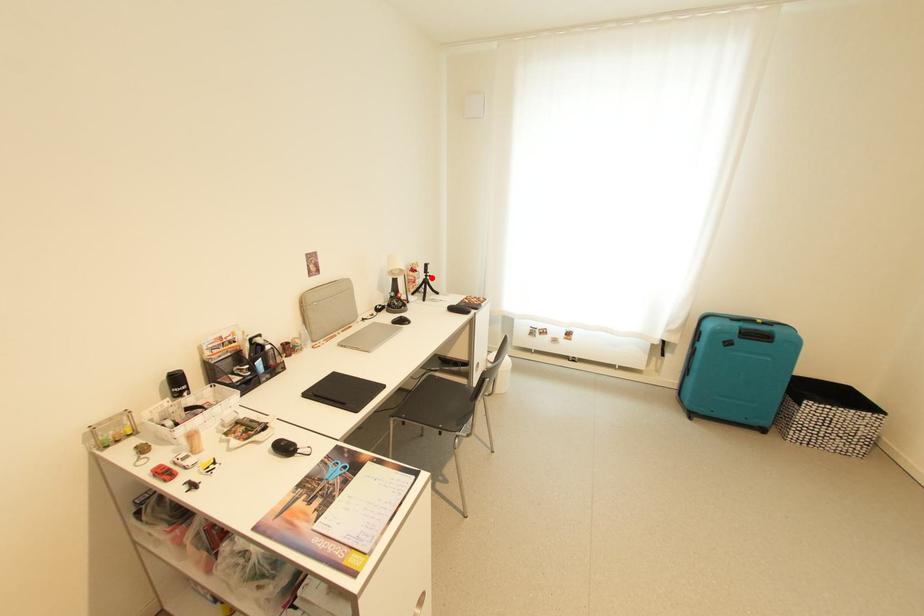
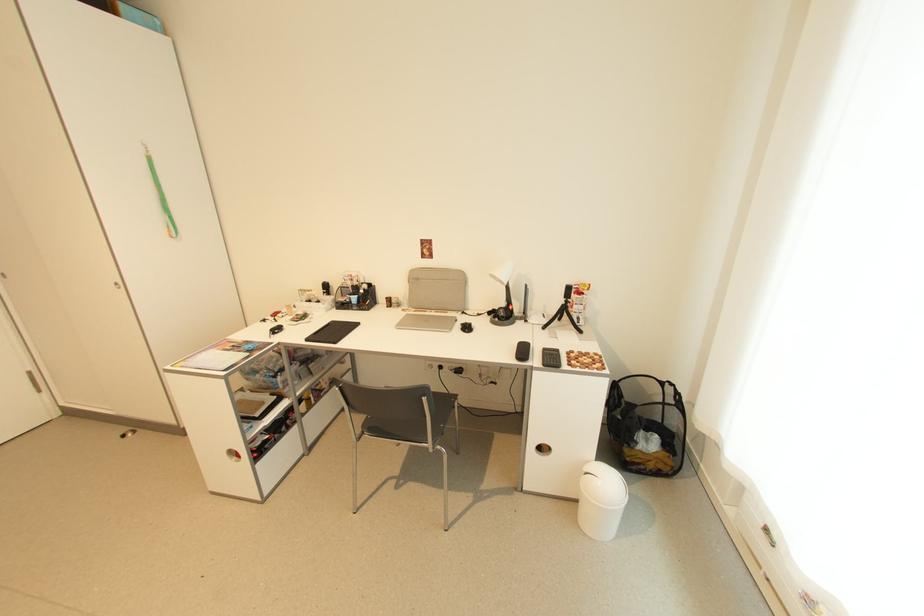
Locate, in the second image, the point that corresponds to the highlighted location in the first image.

(572, 302)